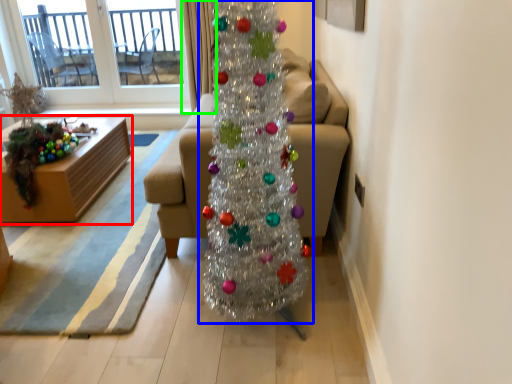
Question: Estimate the real-world distances between objects in this image. Which object is closer to furniture (highlighted by a red box), christmas tree (highlighted by a blue box) or curtain (highlighted by a green box)?

Choices:
 (A) christmas tree
 (B) curtain

Answer: (B)